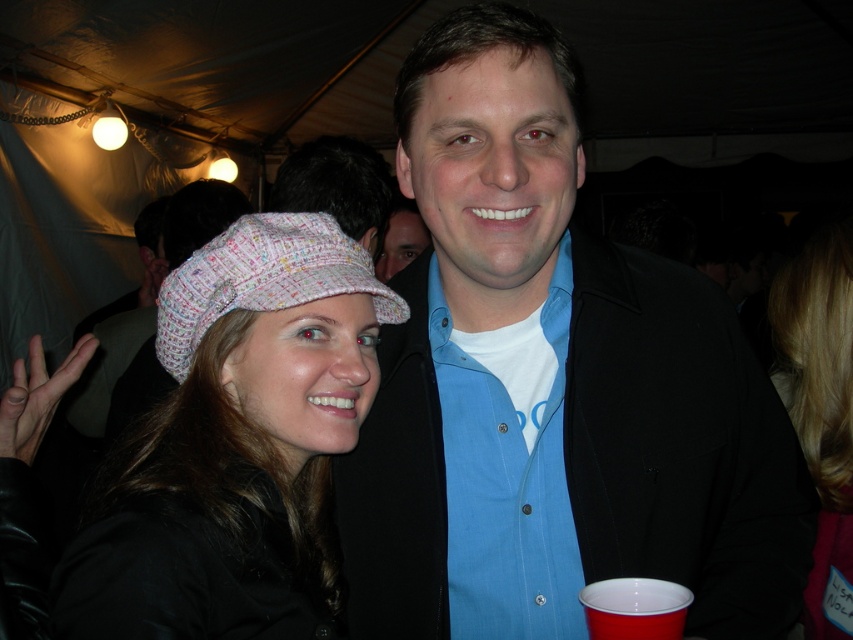
Can you confirm if blonde hair at center is taller than textile knit cap at center?

Yes.

Which is behind, point (793, 301) or point (326, 296)?

Positioned behind is point (793, 301).

Image resolution: width=853 pixels, height=640 pixels. I want to click on blonde hair at center, so click(x=821, y=406).

Does textured knit hat at left come behind knitted fabric hat at upper left?

No, it is not.

Who is lower down, textured knit hat at left or knitted fabric hat at upper left?

Positioned lower is textured knit hat at left.

The width and height of the screenshot is (853, 640). What are the coordinates of `textured knit hat at left` in the screenshot? It's located at (235, 445).

Which is more to the left, knitted fabric hat at upper left or red plastic cup at lower right?

knitted fabric hat at upper left

Measure the distance between knitted fabric hat at upper left and red plastic cup at lower right.

4.57 feet

What do you see at coordinates (337, 186) in the screenshot? I see `knitted fabric hat at upper left` at bounding box center [337, 186].

The image size is (853, 640). Identify the location of knitted fabric hat at upper left. (337, 186).